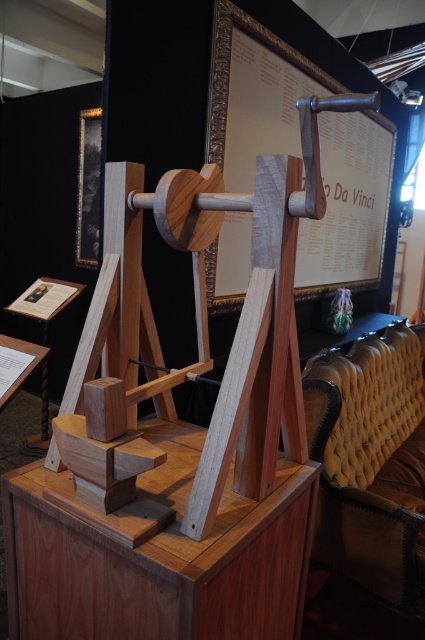
Does point (212, 246) lie in front of point (422, 566)?

No, it is behind (422, 566).

Is wooden framed poster at center to the left of leather tufted armchair at right from the viewer's perspective?

Yes, wooden framed poster at center is to the left of leather tufted armchair at right.

Is point (224, 260) less distant than point (336, 509)?

No, it is behind (336, 509).

This screenshot has width=425, height=640. I want to click on wooden framed poster at center, so click(255, 93).

Does wooden table at center have a greater width compared to leather tufted armchair at right?

In fact, wooden table at center might be narrower than leather tufted armchair at right.

Does wooden table at center come behind leather tufted armchair at right?

No, wooden table at center is in front of leather tufted armchair at right.

Which is behind, point (5, 496) or point (385, 438)?

Positioned behind is point (385, 438).

Where is `wooden table at center`? The image size is (425, 640). wooden table at center is located at coordinates (158, 566).

Does wooden table at center appear under wooden framed poster at center?

Yes.

Is wooden table at center smaller than wooden framed poster at center?

Yes.

Who is more forward, (306,506) or (243,180)?

Point (306,506) is in front.

Find the location of `wooden table at center`. wooden table at center is located at coordinates (158, 566).